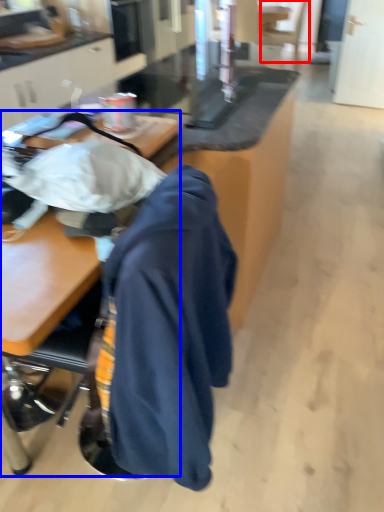
Question: Which of the following is the closest to the observer, swivel chair (highlighted by a red box) or desk (highlighted by a blue box)?

Choices:
 (A) swivel chair
 (B) desk

Answer: (B)